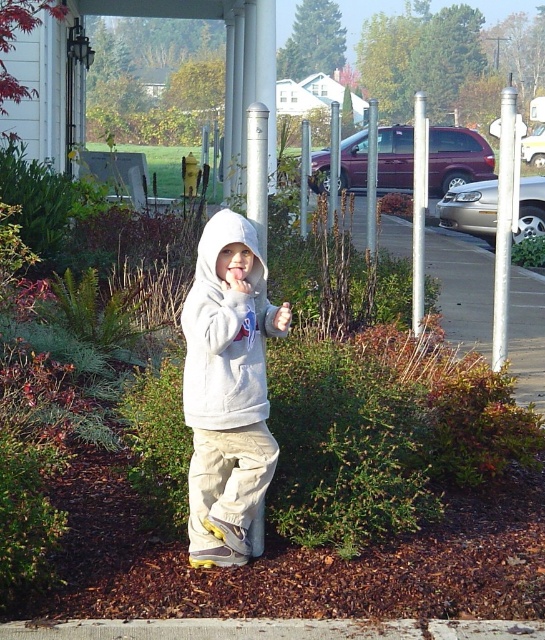
Question: Which point is closer to the camera?

Choices:
 (A) white plastic pole at center
 (B) silver metallic pole at center

Answer: (A)

Question: Which is nearer to the silver metallic pole at center?

Choices:
 (A) light gray hoodie at center
 (B) white plastic pole at center

Answer: (B)

Question: Observing the image, what is the correct spatial positioning of white plastic pole at center in reference to silver metallic pole at center?

Choices:
 (A) above
 (B) below

Answer: (A)

Question: Is the position of white plastic pole at center more distant than that of silver metallic pole at center?

Choices:
 (A) no
 (B) yes

Answer: (A)

Question: Based on their relative distances, which object is nearer to the silver metallic pole at center?

Choices:
 (A) white plastic pole at center
 (B) light gray hoodie at center

Answer: (A)

Question: In this image, where is white plastic pole at center located relative to silver metallic pole at center?

Choices:
 (A) left
 (B) right

Answer: (B)